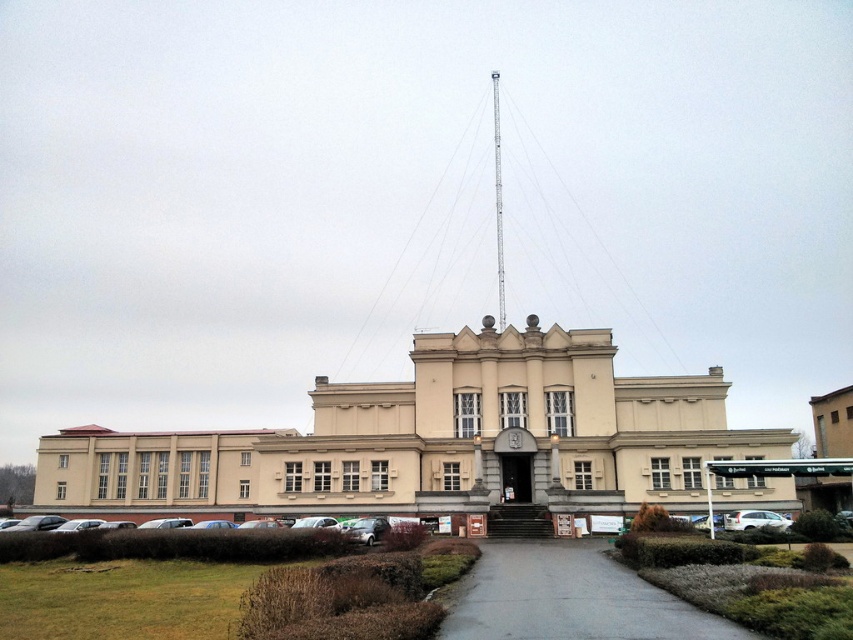
Question: Which of the following is the farthest from the observer?

Choices:
 (A) (548, 630)
 (B) (741, 442)

Answer: (B)

Question: Does beige stone building at center have a larger size compared to gray asphalt path at center?

Choices:
 (A) no
 (B) yes

Answer: (B)

Question: Which point appears farthest from the camera in this image?

Choices:
 (A) pos(643,499)
 (B) pos(483,586)

Answer: (A)

Question: Is beige stone building at center closer to camera compared to gray asphalt path at center?

Choices:
 (A) no
 (B) yes

Answer: (A)

Question: Which point is farther to the camera?

Choices:
 (A) (595, 605)
 (B) (48, 481)

Answer: (B)

Question: Is beige stone building at center wider than gray asphalt path at center?

Choices:
 (A) no
 (B) yes

Answer: (B)